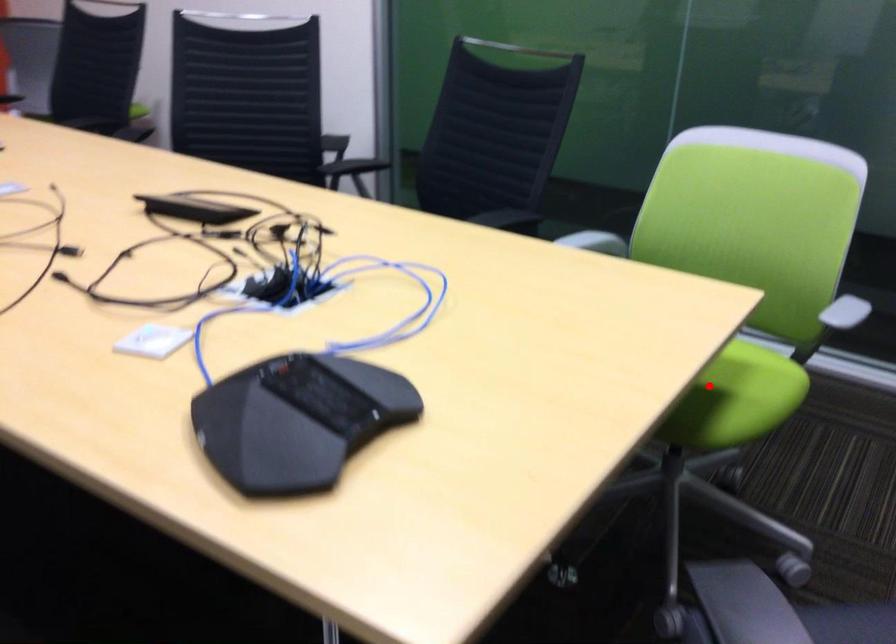
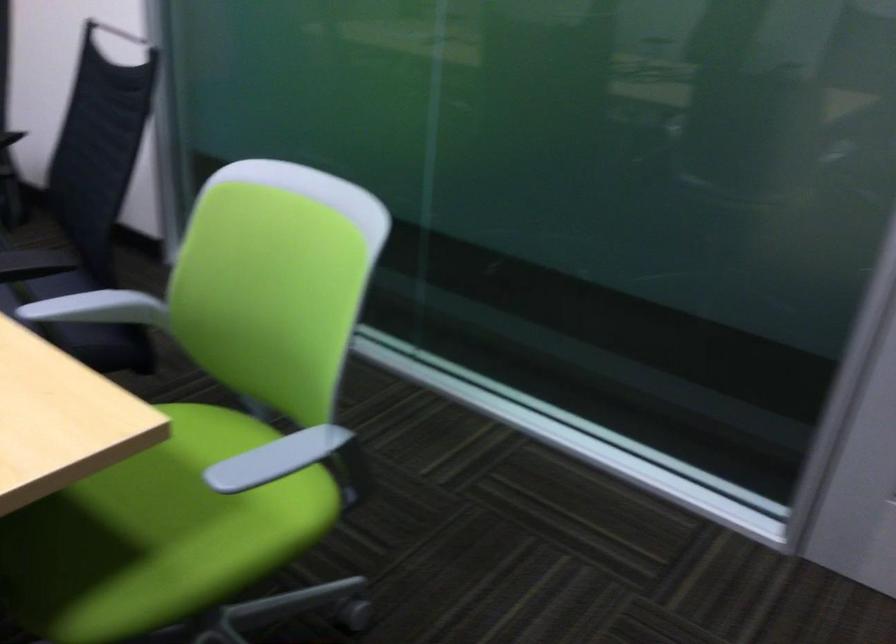
Find the pixel in the second image that matches the highlighted location in the first image.

(157, 534)